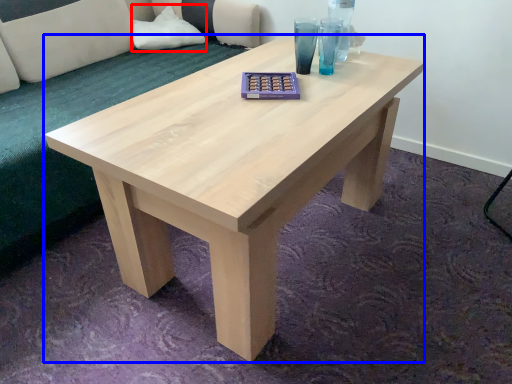
Question: Which of the following is the farthest to the observer, pillow (highlighted by a red box) or coffee table (highlighted by a blue box)?

Choices:
 (A) pillow
 (B) coffee table

Answer: (A)